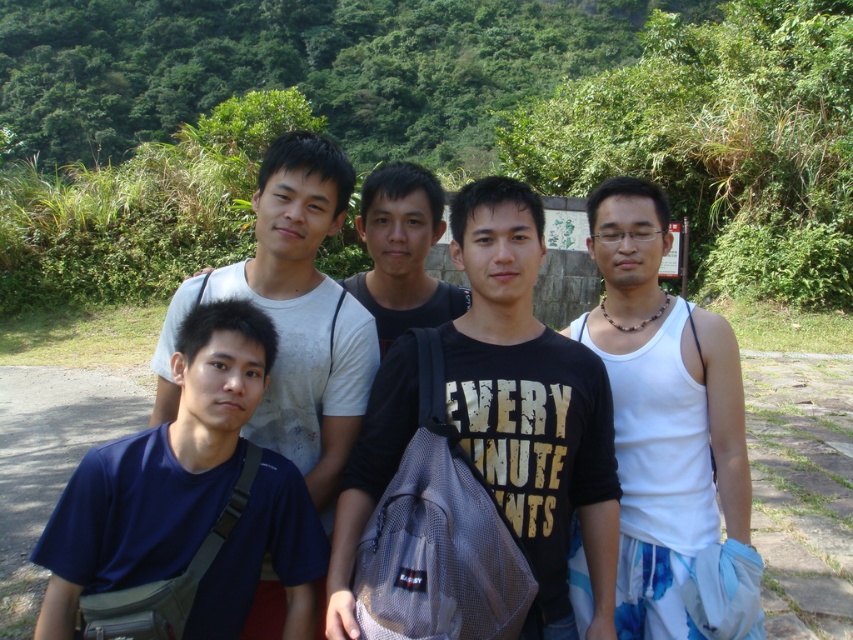
Question: Does black mesh backpack at center appear over white tank top at right?

Choices:
 (A) yes
 (B) no

Answer: (A)

Question: Based on their relative distances, which object is farther from the black matte shirt at center?

Choices:
 (A) light gray t-shirt at center
 (B) black mesh backpack at center
 (C) dark blue fabric shirt at lower left

Answer: (C)

Question: Is black mesh backpack at center in front of dark blue fabric shirt at lower left?

Choices:
 (A) yes
 (B) no

Answer: (A)

Question: Which object is closer to the camera taking this photo?

Choices:
 (A) white tank top at right
 (B) dark blue fabric shirt at lower left
 (C) black mesh backpack at center

Answer: (C)

Question: Does white tank top at right appear on the left side of black matte shirt at center?

Choices:
 (A) no
 (B) yes

Answer: (A)

Question: Estimate the real-world distances between objects in this image. Which object is closer to the black matte shirt at center?

Choices:
 (A) light gray t-shirt at center
 (B) black mesh backpack at center
 (C) dark blue fabric shirt at lower left
 (D) white tank top at right

Answer: (A)